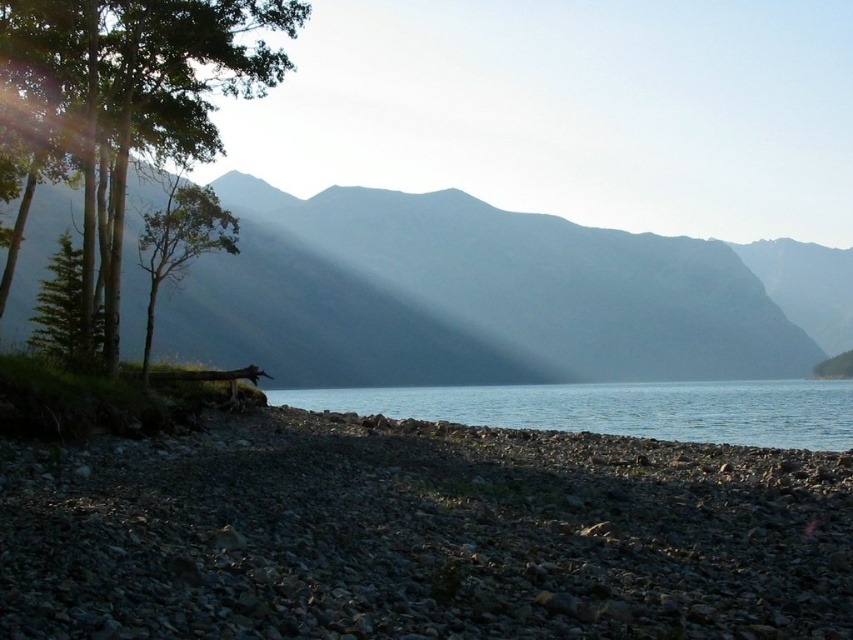
Question: Which point appears farthest from the camera in this image?

Choices:
 (A) (569, 429)
 (B) (265, 80)

Answer: (A)

Question: In this image, where is smooth gray mountain at center located relative to clear water at center?

Choices:
 (A) above
 (B) below

Answer: (A)

Question: Is smooth gray mountain at center positioned in front of green matte tree at left?

Choices:
 (A) yes
 (B) no

Answer: (B)

Question: Which of the following is the farthest from the observer?

Choices:
 (A) clear water at center
 (B) green matte tree at left
 (C) smooth gray mountain at center

Answer: (C)

Question: Among these objects, which one is farthest from the camera?

Choices:
 (A) green matte tree at left
 (B) smooth gray mountain at center

Answer: (B)

Question: Can you confirm if smooth gray mountain at center is positioned to the left of green matte tree at left?

Choices:
 (A) yes
 (B) no

Answer: (B)